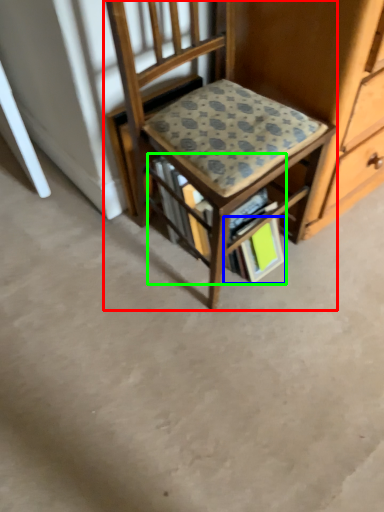
Question: Considering the real-world distances, which object is closest to chair (highlighted by a red box)? paperback book (highlighted by a blue box) or book (highlighted by a green box).

Choices:
 (A) paperback book
 (B) book

Answer: (B)